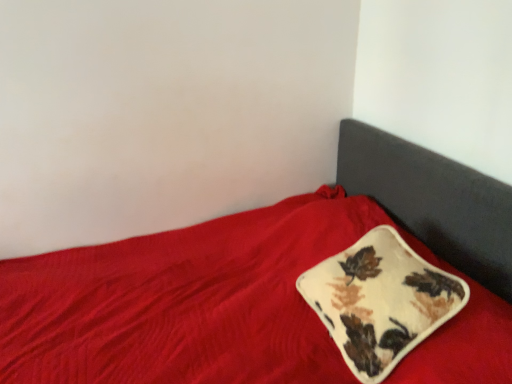
Question: Is point (369, 266) positioned closer to the camera than point (463, 269)?

Choices:
 (A) farther
 (B) closer

Answer: (B)

Question: In the image, is velvety cream pillow with autumn leaves at center positioned in front of or behind velvet red bed at center?

Choices:
 (A) behind
 (B) front

Answer: (A)

Question: Is velvety cream pillow with autumn leaves at center inside or outside of velvet red bed at center?

Choices:
 (A) outside
 (B) inside

Answer: (B)

Question: From their relative heights in the image, would you say velvet red bed at center is taller or shorter than velvety cream pillow with autumn leaves at center?

Choices:
 (A) tall
 (B) short

Answer: (A)

Question: From a real-world perspective, is velvet red bed at center above or below velvety cream pillow with autumn leaves at center?

Choices:
 (A) above
 (B) below

Answer: (B)

Question: Would you say velvet red bed at center is inside or outside velvety cream pillow with autumn leaves at center?

Choices:
 (A) inside
 (B) outside

Answer: (B)

Question: From the image's perspective, is velvet red bed at center located above or below velvety cream pillow with autumn leaves at center?

Choices:
 (A) below
 (B) above

Answer: (A)